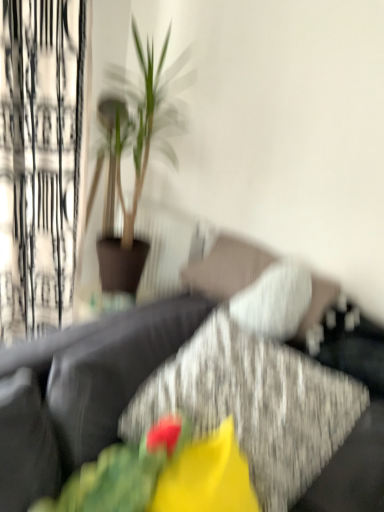
Locate an element on the screen. The height and width of the screenshot is (512, 384). matte yellow flower at center is located at coordinates (207, 477).

From the picture: Considering the sizes of objects fluffy fabric flower at center and white sheer curtain at left in the image provided, who is shorter, fluffy fabric flower at center or white sheer curtain at left?

fluffy fabric flower at center.

Considering the relative sizes of fluffy fabric flower at center and white sheer curtain at left in the image provided, is fluffy fabric flower at center wider than white sheer curtain at left?

Yes, fluffy fabric flower at center is wider than white sheer curtain at left.

Is fluffy fabric flower at center inside or outside of white sheer curtain at left?

fluffy fabric flower at center is not enclosed by white sheer curtain at left.

Would you say white sheer curtain at left is to the left or to the right of textured gray couch at center in the picture?

Based on their positions, white sheer curtain at left is located to the left of textured gray couch at center.

I want to click on curtain located above the textured gray couch at center (from a real-world perspective), so click(x=39, y=161).

Is white sheer curtain at left positioned with its back to textured gray couch at center?

No, white sheer curtain at left is not facing away from textured gray couch at center.

Is textured gray couch at center positioned in front of fluffy fabric flower at center?

No, textured gray couch at center is further to the viewer.

Identify the location of studio couch above the fluffy fabric flower at center (from a real-world perspective). (102, 374).

From a real-world perspective, is textured gray couch at center on top of fluffy fabric flower at center?

Yes, from a real-world perspective, textured gray couch at center is above fluffy fabric flower at center.

Is textured gray couch at center aimed at fluffy fabric flower at center?

Yes, textured gray couch at center is facing fluffy fabric flower at center.

Which is in front, green leafy plant at upper left or white sheer curtain at left?

green leafy plant at upper left is more forward.

How different are the orientations of green leafy plant at upper left and white sheer curtain at left in degrees?

They differ by 88.8 degrees in their facing directions.

From the image's perspective, who appears lower, green leafy plant at upper left or white sheer curtain at left?

green leafy plant at upper left, from the image's perspective.

Is green leafy plant at upper left inside the boundaries of white sheer curtain at left, or outside?

green leafy plant at upper left cannot be found inside white sheer curtain at left.

Considering the relative positions of matte yellow flower at center and fluffy fabric flower at center in the image provided, is matte yellow flower at center to the left or to the right of fluffy fabric flower at center?

matte yellow flower at center is to the right of fluffy fabric flower at center.

Is matte yellow flower at center oriented towards fluffy fabric flower at center?

No, matte yellow flower at center is not aimed at fluffy fabric flower at center.

From the image's perspective, is matte yellow flower at center located above fluffy fabric flower at center?

No, from the image's perspective, matte yellow flower at center is not over fluffy fabric flower at center.

Is matte yellow flower at center thinner than fluffy fabric flower at center?

No.

Is textured gray couch at center to the left of green leafy plant at upper left from the viewer's perspective?

No, textured gray couch at center is not to the left of green leafy plant at upper left.

What's the angular difference between textured gray couch at center and green leafy plant at upper left's facing directions?

41.4 degrees.

From a real-world perspective, between textured gray couch at center and green leafy plant at upper left, who is vertically higher?

In real-world perspective, green leafy plant at upper left is above.

Is textured gray couch at center positioned beyond the bounds of green leafy plant at upper left?

Yes, textured gray couch at center is not within green leafy plant at upper left.

Identify the location of flower below the green leafy plant at upper left (from the image's perspective). This screenshot has width=384, height=512. (207, 477).

In the image, is matte yellow flower at center positioned in front of or behind green leafy plant at upper left?

matte yellow flower at center is positioned closer to the viewer than green leafy plant at upper left.

Is matte yellow flower at center to the left of green leafy plant at upper left from the viewer's perspective?

No.

Locate an element on the screen. The width and height of the screenshot is (384, 512). floral arrangement below the white sheer curtain at left (from the image's perspective) is located at coordinates (162, 475).

Locate an element on the screen. This screenshot has height=512, width=384. studio couch located in front of the white sheer curtain at left is located at coordinates (102, 374).

Which object lies further to the anchor point green leafy plant at upper left, fluffy fabric flower at center or white sheer curtain at left?

The object further to green leafy plant at upper left is fluffy fabric flower at center.

Based on the photo, looking at the image, which one is located closer to green leafy plant at upper left, matte yellow flower at center or white sheer curtain at left?

Among the two, white sheer curtain at left is located nearer to green leafy plant at upper left.

Based on their spatial positions, is white sheer curtain at left or fluffy fabric flower at center closer to textured gray couch at center?

fluffy fabric flower at center is positioned closer to the anchor textured gray couch at center.

When comparing their distances from matte yellow flower at center, does white sheer curtain at left or textured gray couch at center seem closer?

Among the two, textured gray couch at center is located nearer to matte yellow flower at center.

From the image, which object appears to be farther from matte yellow flower at center, fluffy fabric flower at center or textured gray couch at center?

textured gray couch at center.

Based on their spatial positions, is matte yellow flower at center or green leafy plant at upper left closer to textured gray couch at center?

Based on the image, matte yellow flower at center appears to be nearer to textured gray couch at center.

Looking at the image, which one is located closer to fluffy fabric flower at center, green leafy plant at upper left or textured gray couch at center?

textured gray couch at center lies closer to fluffy fabric flower at center than the other object.

Considering their positions, is white sheer curtain at left positioned further to matte yellow flower at center than fluffy fabric flower at center?

Based on the image, white sheer curtain at left appears to be further to matte yellow flower at center.

I want to click on studio couch between green leafy plant at upper left and fluffy fabric flower at center in the vertical direction, so click(x=102, y=374).

This screenshot has height=512, width=384. I want to click on studio couch between white sheer curtain at left and matte yellow flower at center in the vertical direction, so click(102, 374).

The height and width of the screenshot is (512, 384). I want to click on floral arrangement between green leafy plant at upper left and matte yellow flower at center in the vertical direction, so click(162, 475).

Find the location of a particular element. Image resolution: width=384 pixels, height=512 pixels. floral arrangement between white sheer curtain at left and matte yellow flower at center in the vertical direction is located at coordinates (162, 475).